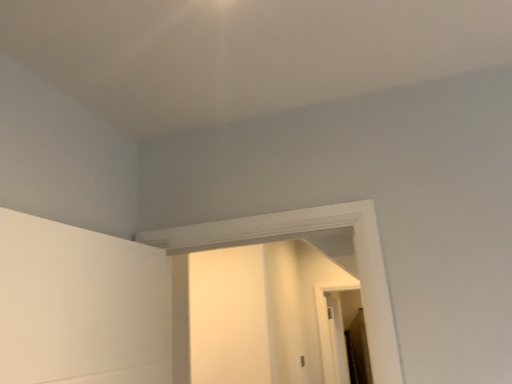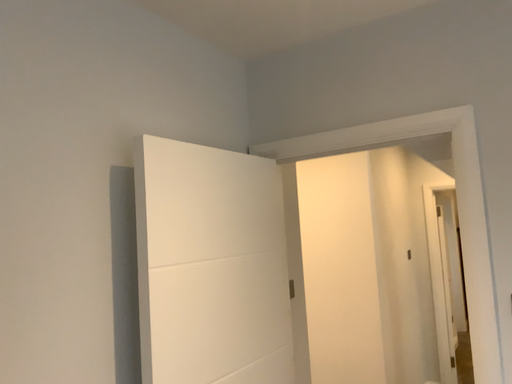
Question: Which way did the camera rotate in the video?

Choices:
 (A) rotated upward
 (B) rotated downward

Answer: (B)